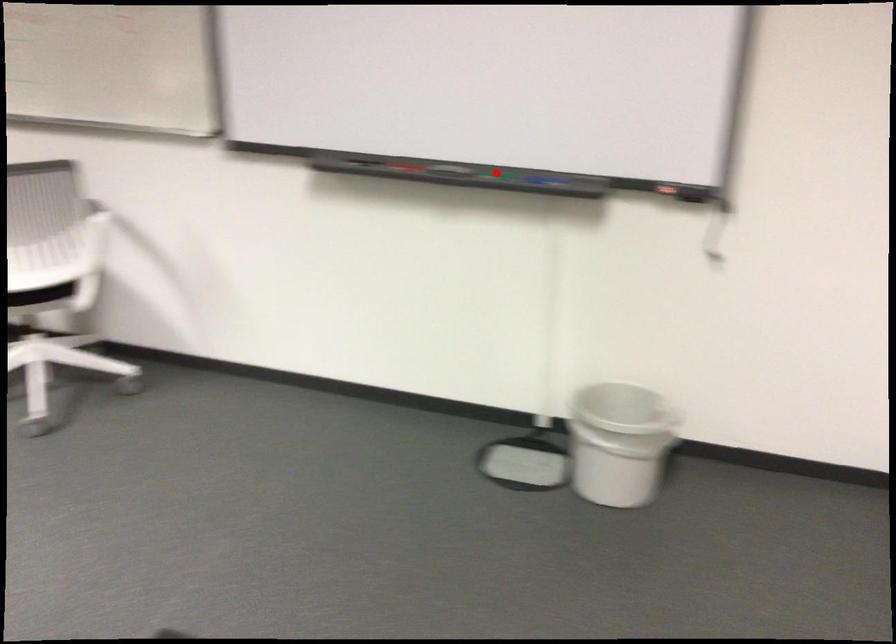
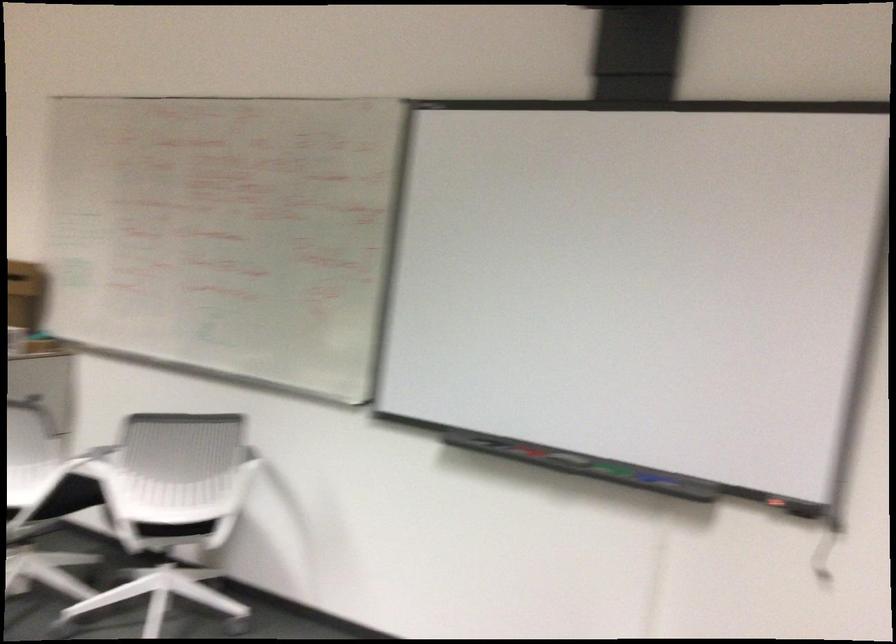
Question: I am providing you with two images of the same scene from different viewpoints. A red point is marked on the first image. Can you still see the location of the red point in image 2?

Choices:
 (A) Yes
 (B) No

Answer: (A)